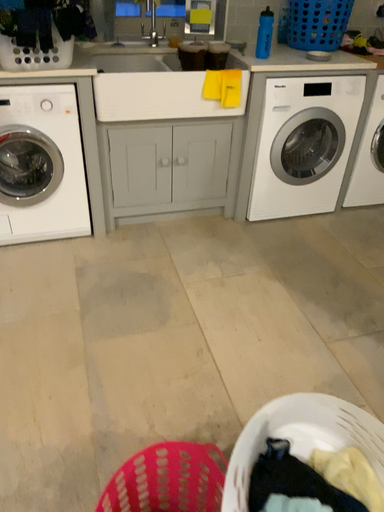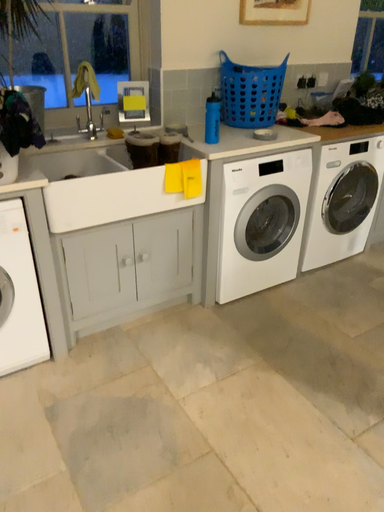
Question: How did the camera likely rotate when shooting the video?

Choices:
 (A) rotated downward
 (B) rotated upward

Answer: (B)